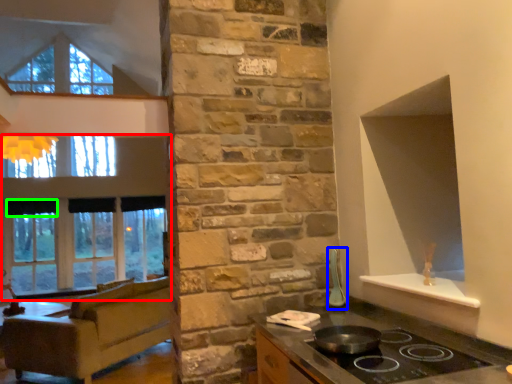
Question: Based on their relative distances, which object is nearer to window (highlighted by a red box)? Choose from appliance (highlighted by a blue box) and curtain (highlighted by a green box).

Choices:
 (A) appliance
 (B) curtain

Answer: (B)